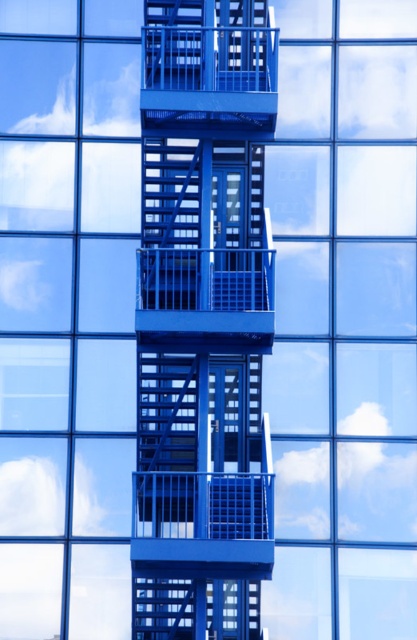
Question: Can you confirm if metallic blue fire escape at center is bigger than metallic blue balcony at center?

Choices:
 (A) no
 (B) yes

Answer: (B)

Question: Which point is closer to the camera?

Choices:
 (A) (243, 72)
 (B) (150, 33)

Answer: (B)

Question: Is metallic blue fire escape at center bigger than metallic blue balcony at center?

Choices:
 (A) no
 (B) yes

Answer: (B)

Question: Can you confirm if metallic blue fire escape at center is positioned to the right of metallic blue balcony at center?

Choices:
 (A) no
 (B) yes

Answer: (A)

Question: Among these points, which one is farthest from the camera?

Choices:
 (A) (248, 634)
 (B) (260, 1)

Answer: (B)